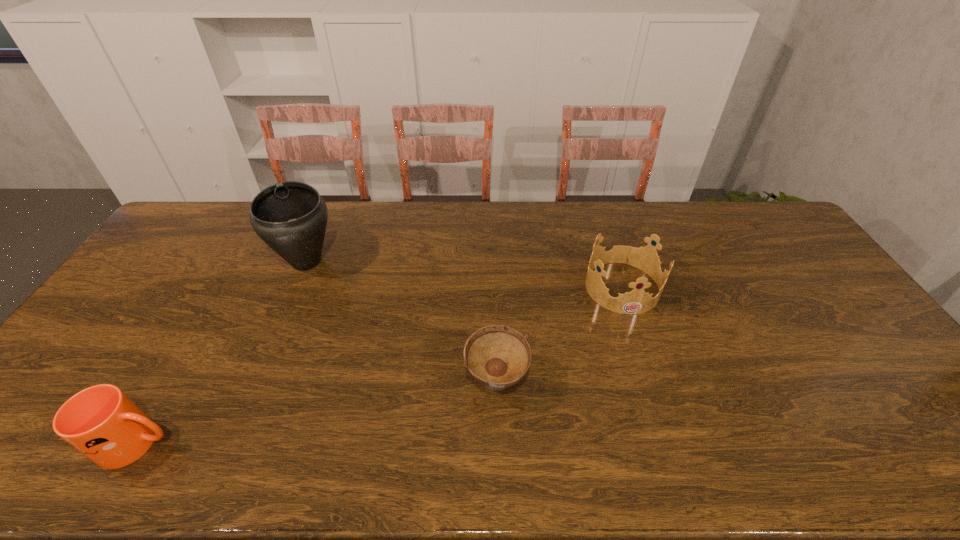
Where is `free space that is in between the soup bowl and the rightmost object`? Image resolution: width=960 pixels, height=540 pixels. free space that is in between the soup bowl and the rightmost object is located at coordinates (559, 335).

You are a GUI agent. You are given a task and a screenshot of the screen. Output one action in this format:
    pyautogui.click(x=<x>, y=<y>)
    Task: Click on the vacant region between the soup bowl and the third object from right to left
    The height and width of the screenshot is (540, 960).
    Given the screenshot: What is the action you would take?
    pyautogui.click(x=401, y=322)

At what (x,y) coordinates should I click in order to perform the action: click on free space between the leftmost object and the urn. Please return your answer as a coordinate pair (x, y). The height and width of the screenshot is (540, 960). Looking at the image, I should click on (223, 353).

Where is `empty space that is in between the mug and the urn`? Image resolution: width=960 pixels, height=540 pixels. empty space that is in between the mug and the urn is located at coordinates (223, 353).

Identify the location of free point between the rightmost object and the urn. (464, 274).

Locate an element on the screen. The image size is (960, 540). free space that is in between the rightmost object and the third object from left to right is located at coordinates (559, 335).

Image resolution: width=960 pixels, height=540 pixels. In order to click on free area in between the nearest object and the rightmost object in this screenshot , I will do pos(380,365).

This screenshot has width=960, height=540. Find the location of `vacant space in between the tiara and the soup bowl`. vacant space in between the tiara and the soup bowl is located at coordinates (559, 335).

Identify the location of vacant point located between the rightmost object and the third object from right to left. (464, 274).

Identify which object is located as the nearest to the rightmost object. Please provide its 2D coordinates. Your answer should be formatted as a tuple, i.e. [(x, y)], where the tuple contains the x and y coordinates of a point satisfying the conditions above.

[(497, 356)]